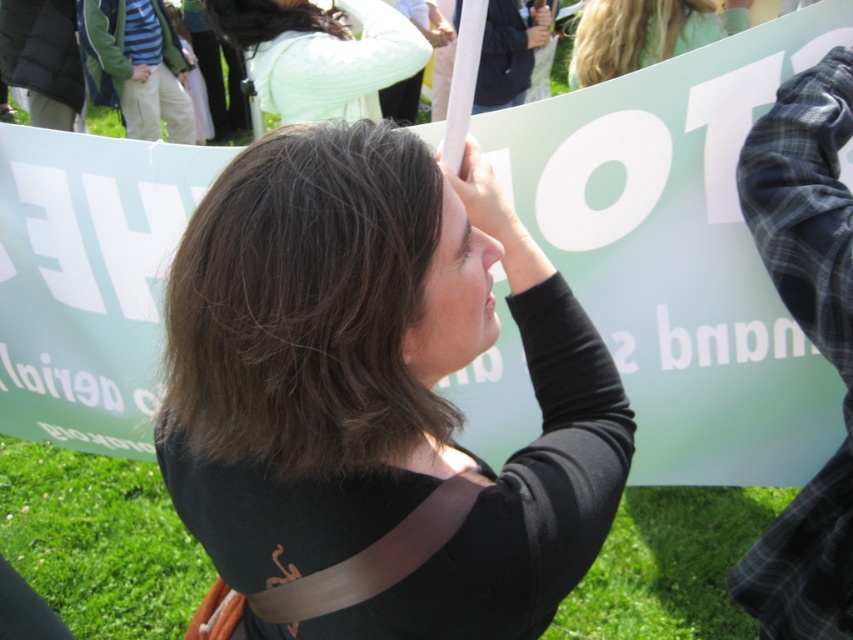
Question: Which object is the closest to the blonde hair at upper center?

Choices:
 (A) black matte shirt at center
 (B) white knitted sweater at upper center

Answer: (B)

Question: Which object appears closest to the camera in this image?

Choices:
 (A) white knitted sweater at upper center
 (B) black matte shirt at center
 (C) blonde hair at upper center

Answer: (B)

Question: Is black matte shirt at center smaller than white knitted sweater at upper center?

Choices:
 (A) yes
 (B) no

Answer: (A)

Question: Is black matte shirt at center smaller than blonde hair at upper center?

Choices:
 (A) no
 (B) yes

Answer: (B)

Question: Which object is closer to the camera taking this photo?

Choices:
 (A) blonde hair at upper center
 (B) black matte shirt at center
 (C) white knitted sweater at upper center

Answer: (B)

Question: Can you confirm if black matte shirt at center is positioned to the right of white knitted sweater at upper center?

Choices:
 (A) no
 (B) yes

Answer: (B)